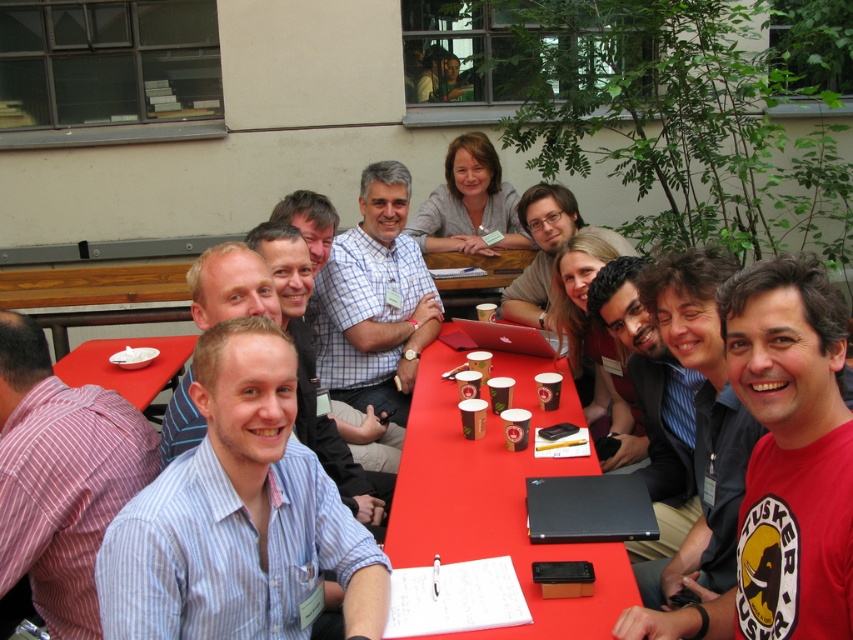
Question: Estimate the real-world distances between objects in this image. Which object is farther from the matte black laptop at center?

Choices:
 (A) blue striped shirt at center
 (B) white checkered shirt at center
 (C) red cotton t-shirt at center
 (D) red plastic table at lower left

Answer: (C)

Question: Based on their relative distances, which object is nearer to the light brown hair at center?

Choices:
 (A) striped cotton shirt at left
 (B) matte black laptop at center

Answer: (A)

Question: Is the position of red plastic table at lower left less distant than that of light brown hair at center?

Choices:
 (A) no
 (B) yes

Answer: (A)

Question: Which of these objects is positioned closest to the striped cotton shirt at left?

Choices:
 (A) white checkered shirt at center
 (B) light blue shirt at center

Answer: (B)

Question: Does red cotton t-shirt at center appear under red plastic table at lower left?

Choices:
 (A) no
 (B) yes

Answer: (A)

Question: Is red cotton t-shirt at center closer to the viewer compared to white checkered shirt at center?

Choices:
 (A) yes
 (B) no

Answer: (A)